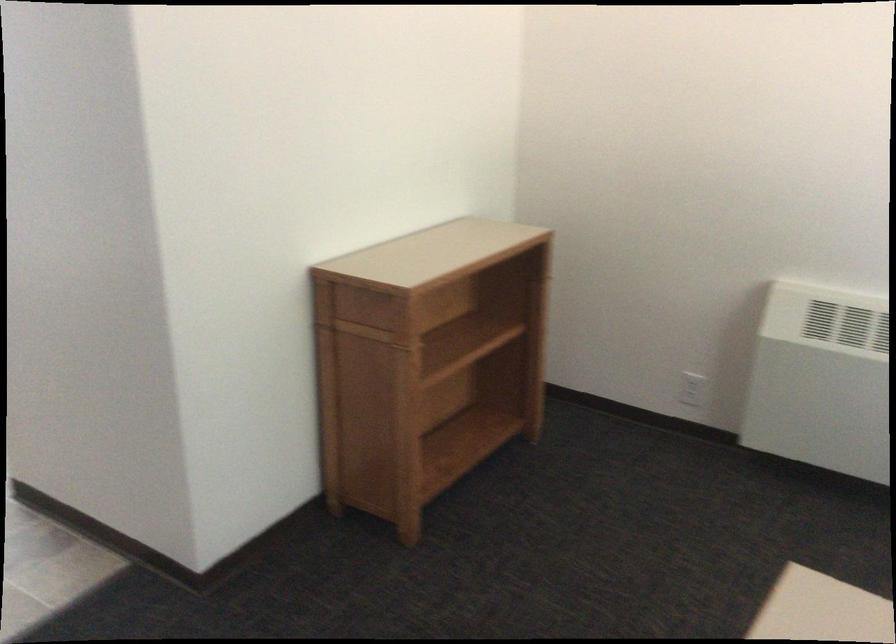
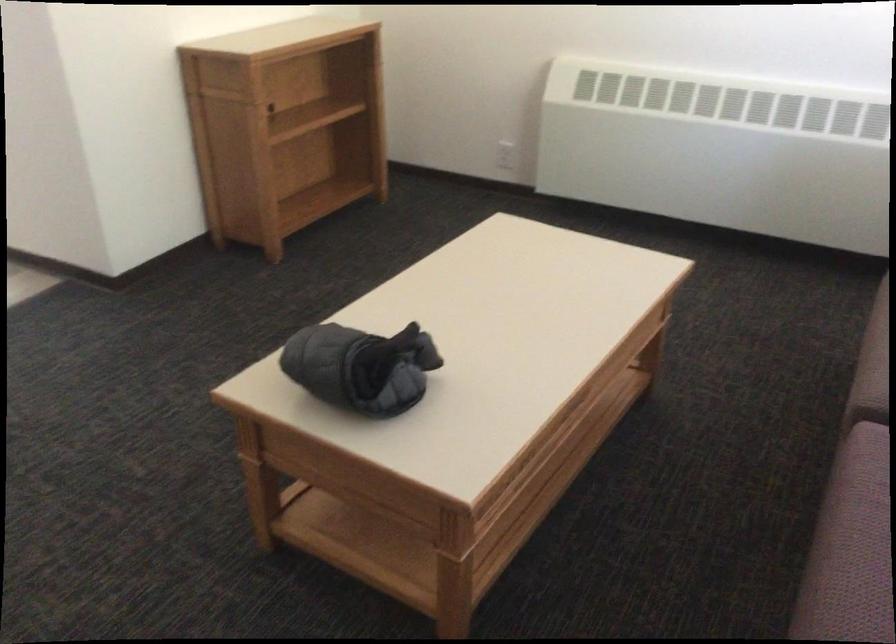
Question: Based on the continuous images, in which direction is the camera rotating? Reply with the corresponding letter.

Choices:
 (A) Left
 (B) Right
 (C) Up
 (D) Down

Answer: (D)